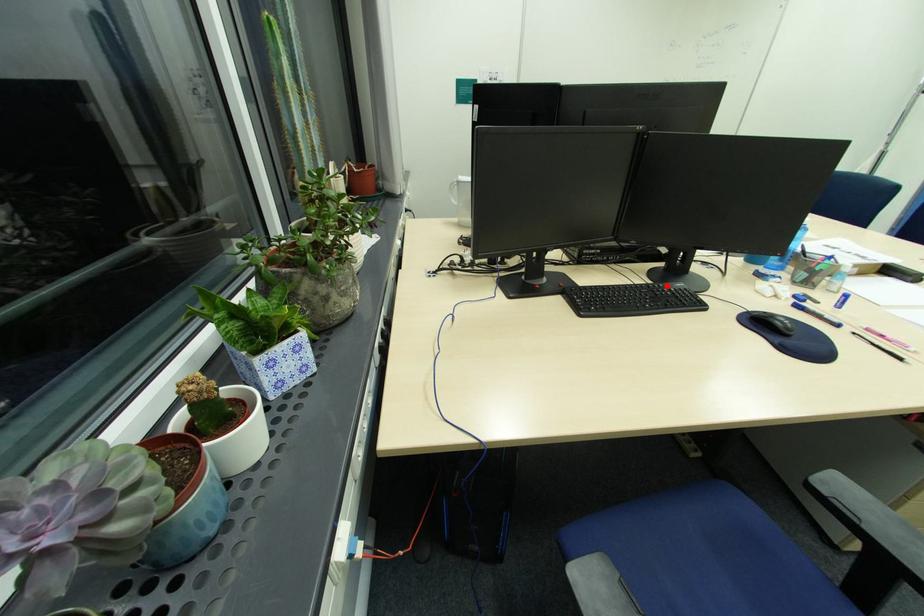
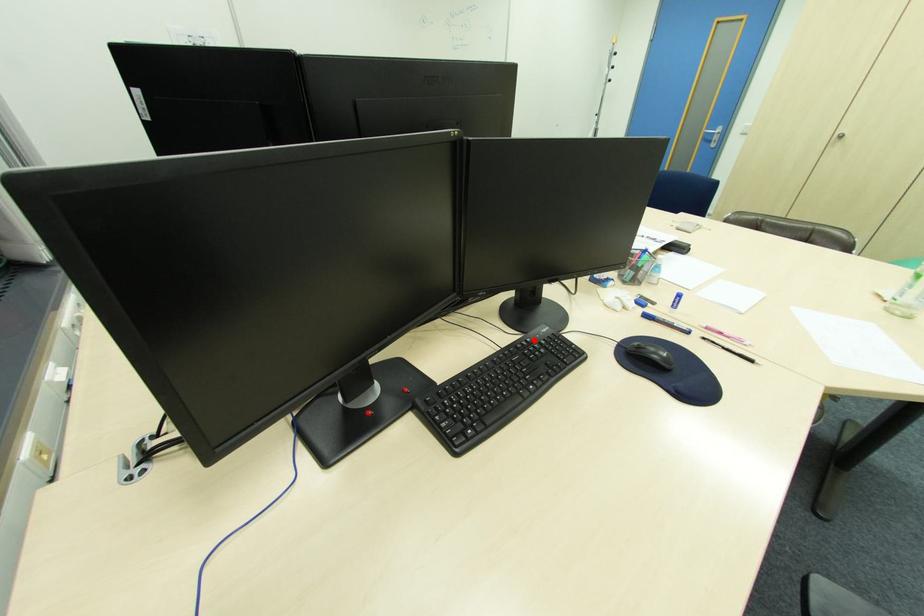
From the picture: I am providing you with two images of the same scene from different viewpoints. A red point is marked on the first image and another point is marked on the second image. Are the points marked in image1 and image2 representing the same 3D position?

Yes